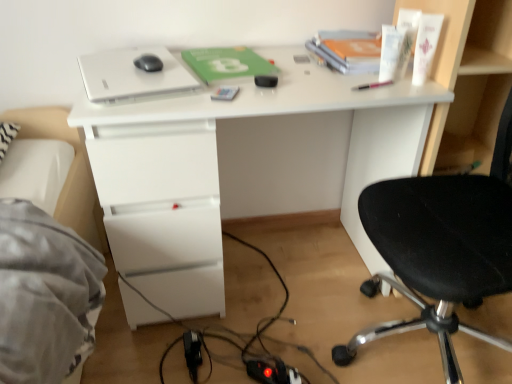
The image size is (512, 384). In order to click on empty space that is ontop of white matte laptop at upper center (from a real-world perspective) in this screenshot , I will do `click(135, 67)`.